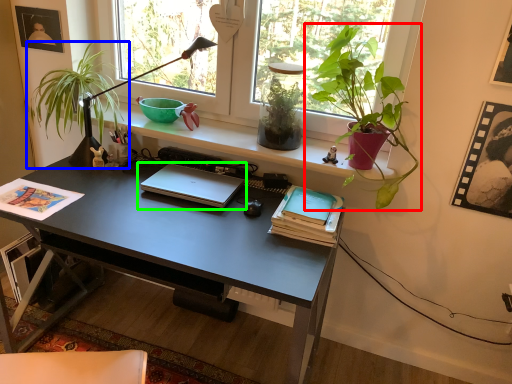
Question: Estimate the real-world distances between objects in this image. Which object is closer to houseplant (highlighted by a red box), houseplant (highlighted by a blue box) or laptop (highlighted by a green box)?

Choices:
 (A) houseplant
 (B) laptop

Answer: (B)